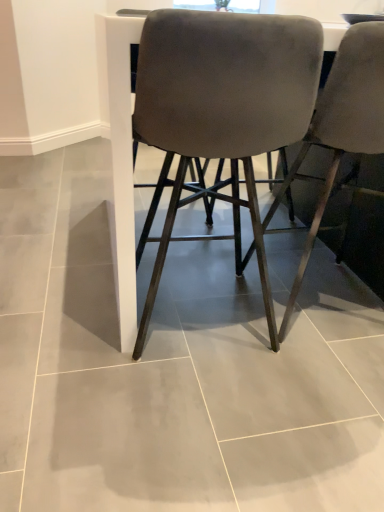
Question: In which direction should I rotate to look at velvet gray chair at center, which is counted as the 2th chair, starting from the left?

Choices:
 (A) right
 (B) left

Answer: (A)

Question: Is velvet gray chair at center, which ranks as the 1th chair in right-to-left order, at the back of suede-like gray chair at center, positioned as the first chair in left-to-right order?

Choices:
 (A) yes
 (B) no

Answer: (B)

Question: From a real-world perspective, does suede-like gray chair at center, positioned as the first chair in left-to-right order, stand above velvet gray chair at center, which is counted as the 2th chair, starting from the left?

Choices:
 (A) no
 (B) yes

Answer: (A)

Question: Considering the relative sizes of suede-like gray chair at center, positioned as the first chair in left-to-right order, and velvet gray chair at center, which ranks as the 1th chair in right-to-left order, in the image provided, is suede-like gray chair at center, positioned as the first chair in left-to-right order, bigger than velvet gray chair at center, which ranks as the 1th chair in right-to-left order,?

Choices:
 (A) no
 (B) yes

Answer: (A)

Question: Is suede-like gray chair at center, positioned as the first chair in left-to-right order, completely or partially outside of velvet gray chair at center, which is counted as the 2th chair, starting from the left?

Choices:
 (A) yes
 (B) no

Answer: (A)

Question: Considering the relative sizes of suede-like gray chair at center, positioned as the first chair in left-to-right order, and velvet gray chair at center, which is counted as the 2th chair, starting from the left, in the image provided, is suede-like gray chair at center, positioned as the first chair in left-to-right order, shorter than velvet gray chair at center, which is counted as the 2th chair, starting from the left,?

Choices:
 (A) no
 (B) yes

Answer: (B)

Question: Is suede-like gray chair at center, which is the second chair in right-to-left order, behind velvet gray chair at center, which ranks as the 1th chair in right-to-left order?

Choices:
 (A) no
 (B) yes

Answer: (A)

Question: Considering the relative sizes of velvet gray chair at center, which ranks as the 1th chair in right-to-left order, and suede-like gray chair at center, which is the second chair in right-to-left order, in the image provided, is velvet gray chair at center, which ranks as the 1th chair in right-to-left order, smaller than suede-like gray chair at center, which is the second chair in right-to-left order,?

Choices:
 (A) no
 (B) yes

Answer: (A)

Question: Can you confirm if velvet gray chair at center, which ranks as the 1th chair in right-to-left order, is wider than suede-like gray chair at center, which is the second chair in right-to-left order?

Choices:
 (A) yes
 (B) no

Answer: (A)

Question: Considering the relative sizes of velvet gray chair at center, which is counted as the 2th chair, starting from the left, and suede-like gray chair at center, positioned as the first chair in left-to-right order, in the image provided, is velvet gray chair at center, which is counted as the 2th chair, starting from the left, bigger than suede-like gray chair at center, positioned as the first chair in left-to-right order,?

Choices:
 (A) no
 (B) yes

Answer: (B)

Question: Is velvet gray chair at center, which is counted as the 2th chair, starting from the left, to the right of suede-like gray chair at center, positioned as the first chair in left-to-right order, from the viewer's perspective?

Choices:
 (A) no
 (B) yes

Answer: (B)

Question: Does velvet gray chair at center, which ranks as the 1th chair in right-to-left order, have a greater height compared to suede-like gray chair at center, positioned as the first chair in left-to-right order?

Choices:
 (A) yes
 (B) no

Answer: (A)

Question: Is velvet gray chair at center, which ranks as the 1th chair in right-to-left order, looking in the opposite direction of suede-like gray chair at center, positioned as the first chair in left-to-right order?

Choices:
 (A) no
 (B) yes

Answer: (A)

Question: Looking at their shapes, would you say suede-like gray chair at center, which is the second chair in right-to-left order, is wider or thinner than velvet gray chair at center, which is counted as the 2th chair, starting from the left?

Choices:
 (A) wide
 (B) thin

Answer: (B)